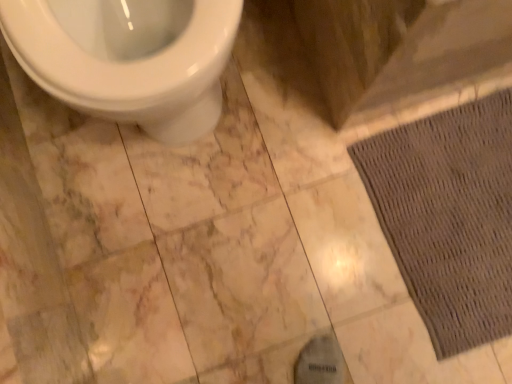
Locate an element on the screen. empty space that is ontop of brown textured mat at lower right (from a real-world perspective) is located at coordinates (462, 211).